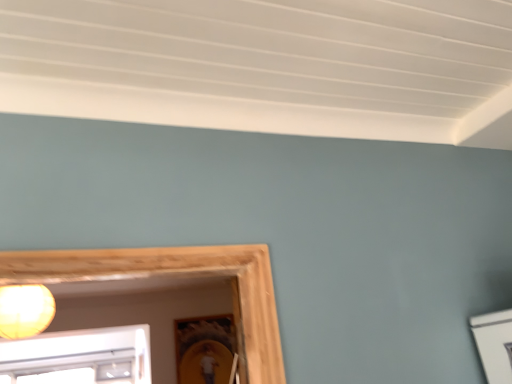
I want to click on matte wooden picture frame at lower center, so click(204, 348).

Describe the element at coordinates (204, 348) in the screenshot. This screenshot has height=384, width=512. I see `matte wooden picture frame at lower center` at that location.

Image resolution: width=512 pixels, height=384 pixels. What do you see at coordinates (25, 310) in the screenshot? I see `matte yellow bulb at upper left` at bounding box center [25, 310].

What are the coordinates of `matte yellow bulb at upper left` in the screenshot? It's located at (25, 310).

In order to click on matte wooden picture frame at lower center in this screenshot , I will do `click(204, 348)`.

Can you confirm if matte yellow bulb at upper left is positioned to the left of matte wooden picture frame at lower center?

Yes, matte yellow bulb at upper left is to the left of matte wooden picture frame at lower center.

Which object is further away from the camera, matte yellow bulb at upper left or matte wooden picture frame at lower center?

matte wooden picture frame at lower center is further away from the camera.

Which is less distant, [47,300] or [229,364]?

The point [47,300] is closer.

From the image's perspective, between matte yellow bulb at upper left and matte wooden picture frame at lower center, which one is located above?

From the image's view, matte yellow bulb at upper left is above.

From a real-world perspective, which is physically below, matte yellow bulb at upper left or matte wooden picture frame at lower center?

matte wooden picture frame at lower center, from a real-world perspective.

Considering the sizes of objects matte yellow bulb at upper left and matte wooden picture frame at lower center in the image provided, who is wider, matte yellow bulb at upper left or matte wooden picture frame at lower center?

With larger width is matte yellow bulb at upper left.

Considering the relative sizes of matte yellow bulb at upper left and matte wooden picture frame at lower center in the image provided, is matte yellow bulb at upper left shorter than matte wooden picture frame at lower center?

Correct, matte yellow bulb at upper left is not as tall as matte wooden picture frame at lower center.

Who is bigger, matte yellow bulb at upper left or matte wooden picture frame at lower center?

matte yellow bulb at upper left.

Is matte yellow bulb at upper left outside of matte wooden picture frame at lower center?

Indeed, matte yellow bulb at upper left is completely outside matte wooden picture frame at lower center.

In the scene shown: Are matte yellow bulb at upper left and matte wooden picture frame at lower center located far from each other?

Yes, matte yellow bulb at upper left is far from matte wooden picture frame at lower center.

Could you tell me if matte yellow bulb at upper left is turned towards matte wooden picture frame at lower center?

No, matte yellow bulb at upper left is not turned towards matte wooden picture frame at lower center.

How much distance is there between matte yellow bulb at upper left and matte wooden picture frame at lower center?

2.62 meters.

The width and height of the screenshot is (512, 384). In the image, there is a matte wooden picture frame at lower center. In order to click on lamp above it (from the image's perspective) in this screenshot , I will do `click(25, 310)`.

Is matte wooden picture frame at lower center at the right side of matte yellow bulb at upper left?

Correct, you'll find matte wooden picture frame at lower center to the right of matte yellow bulb at upper left.

Is the position of matte wooden picture frame at lower center more distant than that of matte yellow bulb at upper left?

That is True.

Does point (187, 349) appear closer or farther from the camera than point (46, 309)?

Point (187, 349).

From the image's perspective, between matte wooden picture frame at lower center and matte yellow bulb at upper left, who is located below?

From the image's view, matte wooden picture frame at lower center is below.

In the scene shown: From a real-world perspective, is matte wooden picture frame at lower center positioned under matte yellow bulb at upper left based on gravity?

Yes.

Which of these two, matte wooden picture frame at lower center or matte yellow bulb at upper left, is wider?

With larger width is matte yellow bulb at upper left.

Which of these two, matte wooden picture frame at lower center or matte yellow bulb at upper left, stands taller?

matte wooden picture frame at lower center is taller.

Is matte wooden picture frame at lower center bigger or smaller than matte yellow bulb at upper left?

matte wooden picture frame at lower center is smaller than matte yellow bulb at upper left.

Would you say matte wooden picture frame at lower center is inside or outside matte yellow bulb at upper left?

matte wooden picture frame at lower center cannot be found inside matte yellow bulb at upper left.

Is there a large distance between matte wooden picture frame at lower center and matte yellow bulb at upper left?

matte wooden picture frame at lower center is far away from matte yellow bulb at upper left.

Is matte wooden picture frame at lower center aimed at matte yellow bulb at upper left?

No.

Measure the distance from matte wooden picture frame at lower center to matte yellow bulb at upper left.

matte wooden picture frame at lower center and matte yellow bulb at upper left are 2.62 meters apart.

You are a GUI agent. You are given a task and a screenshot of the screen. Output one action in this format:
    pyautogui.click(x=<x>, y=<y>)
    Task: Click on the picture frame on the right of the matte yellow bulb at upper left
    The height and width of the screenshot is (384, 512).
    Given the screenshot: What is the action you would take?
    pyautogui.click(x=204, y=348)

This screenshot has width=512, height=384. I want to click on lamp that appears on the left of matte wooden picture frame at lower center, so click(x=25, y=310).

Where is `picture frame below the matte yellow bulb at upper left (from a real-world perspective)`? The height and width of the screenshot is (384, 512). picture frame below the matte yellow bulb at upper left (from a real-world perspective) is located at coordinates (204, 348).